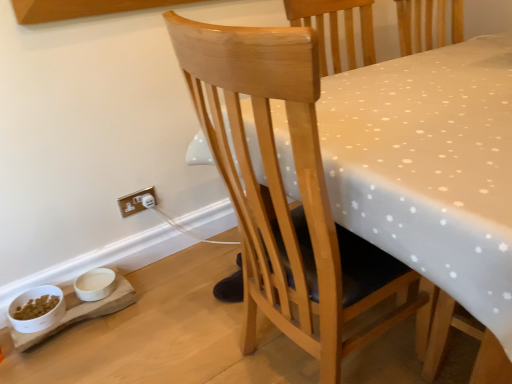
The height and width of the screenshot is (384, 512). What do you see at coordinates (41, 313) in the screenshot? I see `white glossy bowl at lower left, which appears as the 1th bowl when viewed from the left` at bounding box center [41, 313].

Find the location of a particular element. white matte bowl at lower left, the 1th bowl viewed from the right is located at coordinates (95, 284).

What do you see at coordinates (135, 202) in the screenshot? I see `gold metallic electrical outlet at lower left` at bounding box center [135, 202].

What is the approximate width of gold metallic electrical outlet at lower left?

gold metallic electrical outlet at lower left is 1.49 centimeters wide.

You are a GUI agent. You are given a task and a screenshot of the screen. Output one action in this format:
    pyautogui.click(x=<x>, y=<y>)
    Task: Click on the white glossy bowl at lower left, which appears as the 1th bowl when viewed from the left
    
    Given the screenshot: What is the action you would take?
    pyautogui.click(x=41, y=313)

Considering the points (12, 312) and (312, 352), which point is behind, point (12, 312) or point (312, 352)?

The point (12, 312) is farther.

Is white glossy bowl at lower left, the 2th bowl from the right, not within natural wood chair at center?

white glossy bowl at lower left, the 2th bowl from the right, lies outside natural wood chair at center's area.

This screenshot has height=384, width=512. Identify the location of chair located on the right of white glossy bowl at lower left, which appears as the 1th bowl when viewed from the left. (285, 193).

From a real-world perspective, who is located lower, white glossy bowl at lower left, which appears as the 1th bowl when viewed from the left, or natural wood chair at center?

white glossy bowl at lower left, which appears as the 1th bowl when viewed from the left, is physically lower.

Can you tell me how much white matte bowl at lower left, the second bowl viewed from the left, and natural wood chair at center differ in facing direction?

The facing directions of white matte bowl at lower left, the second bowl viewed from the left, and natural wood chair at center are 91.7 degrees apart.

From the picture: Is white matte bowl at lower left, the 1th bowl viewed from the right, not inside natural wood chair at center?

Yes, white matte bowl at lower left, the 1th bowl viewed from the right, is located beyond the bounds of natural wood chair at center.

Considering the sizes of objects white matte bowl at lower left, the second bowl viewed from the left, and natural wood chair at center in the image provided, who is smaller, white matte bowl at lower left, the second bowl viewed from the left, or natural wood chair at center?

With smaller size is white matte bowl at lower left, the second bowl viewed from the left.

Looking at this image, is white matte bowl at lower left, the second bowl viewed from the left, at the left side of natural wood chair at center?

Indeed, white matte bowl at lower left, the second bowl viewed from the left, is positioned on the left side of natural wood chair at center.

Would you say gold metallic electrical outlet at lower left is inside or outside white glossy bowl at lower left, which appears as the 1th bowl when viewed from the left?

The correct answer is: outside.

The width and height of the screenshot is (512, 384). I want to click on electric outlet above the white glossy bowl at lower left, which appears as the 1th bowl when viewed from the left (from a real-world perspective), so click(135, 202).

From the image's perspective, which one is positioned lower, gold metallic electrical outlet at lower left or white glossy bowl at lower left, which appears as the 1th bowl when viewed from the left?

Result: white glossy bowl at lower left, which appears as the 1th bowl when viewed from the left, is shown below in the image.

Considering the points (123, 216) and (19, 305), which point is in front, point (123, 216) or point (19, 305)?

The point (19, 305) is in front.

Who is more distant, natural wood chair at center or white glossy bowl at lower left, which appears as the 1th bowl when viewed from the left?

white glossy bowl at lower left, which appears as the 1th bowl when viewed from the left, is more distant.

Considering the sizes of natural wood chair at center and white glossy bowl at lower left, the 2th bowl from the right, in the image, is natural wood chair at center wider or thinner than white glossy bowl at lower left, the 2th bowl from the right,?

natural wood chair at center is wider than white glossy bowl at lower left, the 2th bowl from the right.

Is point (267, 37) closer or farther from the camera than point (37, 288)?

Point (267, 37) appears to be closer to the viewer than point (37, 288).

Do you think natural wood chair at center is within white glossy bowl at lower left, which appears as the 1th bowl when viewed from the left, or outside of it?

natural wood chair at center is not inside white glossy bowl at lower left, which appears as the 1th bowl when viewed from the left, it's outside.

Does natural wood chair at center lie behind gold metallic electrical outlet at lower left?

No, natural wood chair at center is closer to the camera.

Is point (326, 266) farther from camera compared to point (119, 199)?

No, (326, 266) is in front of (119, 199).

Can you confirm if natural wood chair at center is wider than gold metallic electrical outlet at lower left?

Yes.

From a real-world perspective, is gold metallic electrical outlet at lower left positioned above or below white matte bowl at lower left, the second bowl viewed from the left?

gold metallic electrical outlet at lower left is above white matte bowl at lower left, the second bowl viewed from the left.

From the image's perspective, who appears lower, gold metallic electrical outlet at lower left or white matte bowl at lower left, the 1th bowl viewed from the right?

white matte bowl at lower left, the 1th bowl viewed from the right.

Considering the positions of point (125, 207) and point (101, 281), is point (125, 207) closer or farther from the camera than point (101, 281)?

Point (125, 207) is positioned farther from the camera compared to point (101, 281).

Looking at this image, could you tell me if gold metallic electrical outlet at lower left is facing natural wood chair at center?

No, gold metallic electrical outlet at lower left is not aimed at natural wood chair at center.

In the image, is gold metallic electrical outlet at lower left on the left side or the right side of natural wood chair at center?

gold metallic electrical outlet at lower left is positioned on natural wood chair at center's left side.

Which of these two, gold metallic electrical outlet at lower left or natural wood chair at center, stands taller?

natural wood chair at center is taller.

This screenshot has height=384, width=512. In order to click on chair above the gold metallic electrical outlet at lower left (from a real-world perspective) in this screenshot , I will do `click(285, 193)`.

There is a white glossy bowl at lower left, the 2th bowl from the right. Where is `chair above it (from a real-world perspective)`? chair above it (from a real-world perspective) is located at coordinates (285, 193).

In order to click on the 2nd bowl positioned below the natural wood chair at center (from a real-world perspective) in this screenshot , I will do `click(95, 284)`.

From the image, which object appears to be nearer to natural wood chair at center, gold metallic electrical outlet at lower left or white glossy bowl at lower left, the 2th bowl from the right?

The object closer to natural wood chair at center is gold metallic electrical outlet at lower left.

Consider the image. Which object lies further to the anchor point white matte bowl at lower left, the second bowl viewed from the left, gold metallic electrical outlet at lower left or white glossy bowl at lower left, the 2th bowl from the right?

gold metallic electrical outlet at lower left lies further to white matte bowl at lower left, the second bowl viewed from the left, than the other object.

From the image, which object appears to be farther from white glossy bowl at lower left, the 2th bowl from the right, natural wood chair at center or gold metallic electrical outlet at lower left?

natural wood chair at center is positioned further to the anchor white glossy bowl at lower left, the 2th bowl from the right.

Which object lies nearer to the anchor point white matte bowl at lower left, the 1th bowl viewed from the right, white glossy bowl at lower left, which appears as the 1th bowl when viewed from the left, or natural wood chair at center?

white glossy bowl at lower left, which appears as the 1th bowl when viewed from the left.

In the scene shown: Based on their spatial positions, is white glossy bowl at lower left, which appears as the 1th bowl when viewed from the left, or natural wood chair at center closer to gold metallic electrical outlet at lower left?

Based on the image, white glossy bowl at lower left, which appears as the 1th bowl when viewed from the left, appears to be nearer to gold metallic electrical outlet at lower left.

Considering their positions, is white matte bowl at lower left, the 1th bowl viewed from the right, positioned further to gold metallic electrical outlet at lower left than natural wood chair at center?

natural wood chair at center.

Considering their positions, is white matte bowl at lower left, the second bowl viewed from the left, positioned further to gold metallic electrical outlet at lower left than white glossy bowl at lower left, which appears as the 1th bowl when viewed from the left?

white glossy bowl at lower left, which appears as the 1th bowl when viewed from the left, lies further to gold metallic electrical outlet at lower left than the other object.

When comparing their distances from white glossy bowl at lower left, which appears as the 1th bowl when viewed from the left, does natural wood chair at center or white matte bowl at lower left, the 1th bowl viewed from the right, seem closer?

The object closer to white glossy bowl at lower left, which appears as the 1th bowl when viewed from the left, is white matte bowl at lower left, the 1th bowl viewed from the right.

At what (x,y) coordinates should I click in order to perform the action: click on bowl located between white glossy bowl at lower left, which appears as the 1th bowl when viewed from the left, and natural wood chair at center in the left-right direction. Please return your answer as a coordinate pair (x, y). Image resolution: width=512 pixels, height=384 pixels. Looking at the image, I should click on (95, 284).

The image size is (512, 384). Identify the location of electric outlet between white matte bowl at lower left, the 1th bowl viewed from the right, and natural wood chair at center, in the horizontal direction. (135, 202).

You are a GUI agent. You are given a task and a screenshot of the screen. Output one action in this format:
    pyautogui.click(x=<x>, y=<y>)
    Task: Click on the bowl between gold metallic electrical outlet at lower left and white glossy bowl at lower left, the 2th bowl from the right, in the up-down direction
    This screenshot has width=512, height=384.
    Given the screenshot: What is the action you would take?
    pyautogui.click(x=95, y=284)

Where is `electric outlet between white glossy bowl at lower left, the 2th bowl from the right, and natural wood chair at center`? The height and width of the screenshot is (384, 512). electric outlet between white glossy bowl at lower left, the 2th bowl from the right, and natural wood chair at center is located at coordinates (135, 202).